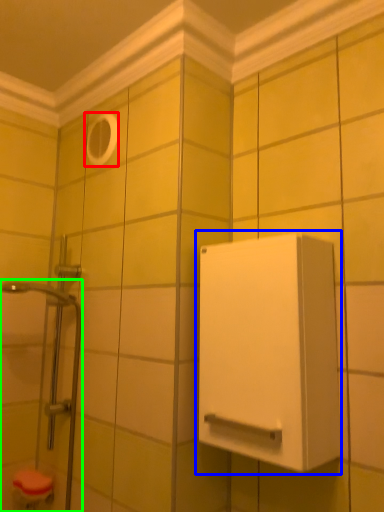
Question: Which object is the closest to the hole (highlighted by a red box)? Choose among these: medicine cabinet (highlighted by a blue box) or shower door (highlighted by a green box).

Choices:
 (A) medicine cabinet
 (B) shower door

Answer: (B)